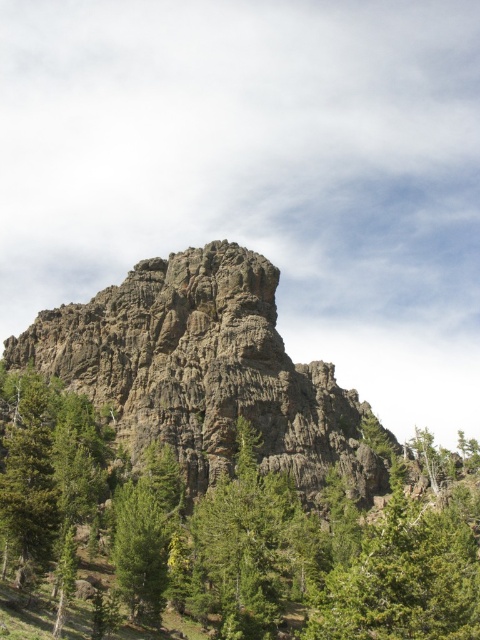
Question: Is rugged stone rock at center smaller than green matte tree at lower left?

Choices:
 (A) no
 (B) yes

Answer: (A)

Question: Is green textured tree at center smaller than green matte tree at lower left?

Choices:
 (A) yes
 (B) no

Answer: (B)

Question: Can you confirm if green textured tree at center is positioned to the right of green matte tree at lower left?

Choices:
 (A) no
 (B) yes

Answer: (B)

Question: Which object appears farthest from the camera in this image?

Choices:
 (A) rugged stone rock at center
 (B) green matte tree at lower left
 (C) green textured tree at center

Answer: (A)

Question: Which point is closer to the camera taking this photo?

Choices:
 (A) (19, 502)
 (B) (128, 548)
 (C) (308, 432)

Answer: (A)

Question: Among these points, which one is nearest to the camera?

Choices:
 (A) (165, 516)
 (B) (264, 512)
 (C) (230, 435)

Answer: (B)